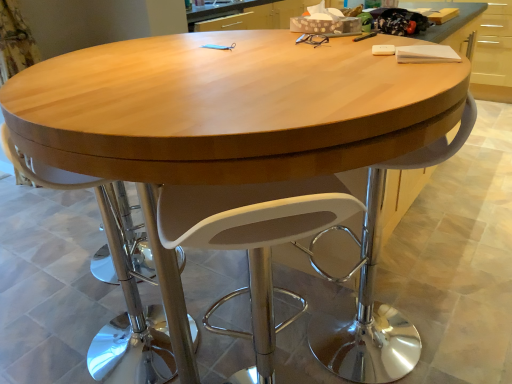
Find the location of `white plastic swivel chair at center`. white plastic swivel chair at center is located at coordinates (253, 241).

This screenshot has width=512, height=384. What do you see at coordinates (253, 241) in the screenshot?
I see `white plastic swivel chair at center` at bounding box center [253, 241].

Based on the photo, measure the distance between point [127,353] and camera.

Point [127,353] is 1.45 meters from camera.

What do you see at coordinates (116, 281) in the screenshot? I see `white plastic chair at center` at bounding box center [116, 281].

This screenshot has height=384, width=512. In order to click on white plastic chair at center in this screenshot , I will do `click(116, 281)`.

Locate an element on the screen. white plastic swivel chair at center is located at coordinates (253, 241).

Which object is positioned more to the left, white plastic chair at center or white plastic swivel chair at center?

white plastic chair at center is more to the left.

Which object is closer to the camera taking this photo, white plastic chair at center or white plastic swivel chair at center?

Positioned in front is white plastic swivel chair at center.

Which is behind, point (164, 368) or point (297, 207)?

The point (164, 368) is farther from the camera.

From the image's perspective, relative to white plastic swivel chair at center, is white plastic chair at center above or below?

Based on their image positions, white plastic chair at center is located above white plastic swivel chair at center.

From a real-world perspective, which object rests below the other?

white plastic chair at center.

Which of these two, white plastic chair at center or white plastic swivel chair at center, is thinner?

white plastic swivel chair at center.

Which of these two, white plastic chair at center or white plastic swivel chair at center, stands shorter?

white plastic swivel chair at center is shorter.

Considering the sizes of objects white plastic chair at center and white plastic swivel chair at center in the image provided, who is bigger, white plastic chair at center or white plastic swivel chair at center?

Bigger between the two is white plastic chair at center.

Can we say white plastic chair at center lies outside white plastic swivel chair at center?

white plastic chair at center is positioned outside white plastic swivel chair at center.

Are white plastic chair at center and white plastic swivel chair at center making contact?

No.

Is white plastic chair at center facing towards white plastic swivel chair at center?

No, white plastic chair at center does not turn towards white plastic swivel chair at center.

Can you tell me how much white plastic chair at center and white plastic swivel chair at center differ in facing direction?

The angle between the facing direction of white plastic chair at center and the facing direction of white plastic swivel chair at center is 73.9 degrees.

How distant is white plastic chair at center from white plastic swivel chair at center?

A distance of 32.58 inches exists between white plastic chair at center and white plastic swivel chair at center.

At what (x,y) coordinates should I click in order to perform the action: click on swivel chair below the white plastic chair at center (from the image's perspective). Please return your answer as a coordinate pair (x, y). This screenshot has width=512, height=384. Looking at the image, I should click on (253, 241).

Is white plastic swivel chair at center at the right side of white plastic chair at center?

Yes.

Between white plastic swivel chair at center and white plastic chair at center, which one is positioned behind?

white plastic chair at center is behind.

Is point (218, 302) closer or farther from the camera than point (128, 382)?

Point (218, 302) is positioned farther from the camera compared to point (128, 382).

Based on the photo, from the image's perspective, is white plastic swivel chair at center above white plastic chair at center?

No, from the image's perspective, white plastic swivel chair at center is not on top of white plastic chair at center.

In the scene shown: From a real-world perspective, is white plastic swivel chair at center positioned over white plastic chair at center based on gravity?

Yes.

Which of these two, white plastic swivel chair at center or white plastic chair at center, is thinner?

white plastic swivel chair at center.

In terms of height, does white plastic swivel chair at center look taller or shorter compared to white plastic chair at center?

Clearly, white plastic swivel chair at center is shorter compared to white plastic chair at center.

Who is bigger, white plastic swivel chair at center or white plastic chair at center?

white plastic chair at center is bigger.

Choose the correct answer: Is white plastic swivel chair at center inside white plastic chair at center or outside it?

white plastic swivel chair at center is spatially situated outside white plastic chair at center.

Consider the image. Is white plastic swivel chair at center beside white plastic chair at center?

There is a gap between white plastic swivel chair at center and white plastic chair at center.

Could you tell me if white plastic swivel chair at center is turned towards white plastic chair at center?

No, white plastic swivel chair at center does not turn towards white plastic chair at center.

How different are the orientations of white plastic swivel chair at center and white plastic chair at center in degrees?

They differ by 73.9 degrees in their facing directions.

This screenshot has width=512, height=384. Find the location of `chair directly beneath the white plastic swivel chair at center (from a real-world perspective)`. chair directly beneath the white plastic swivel chair at center (from a real-world perspective) is located at coordinates (116, 281).

Where is `swivel chair positioned vertically above the white plastic chair at center (from a real-world perspective)`? swivel chair positioned vertically above the white plastic chair at center (from a real-world perspective) is located at coordinates (253, 241).

Identify the location of swivel chair below the white plastic chair at center (from the image's perspective). The height and width of the screenshot is (384, 512). (253, 241).